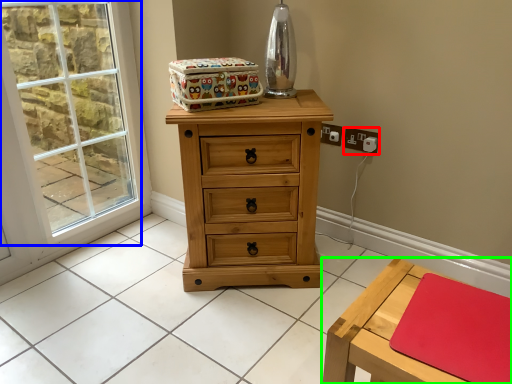
Question: Which object is the farthest from electric outlet (highlighted by a red box)? Choose among these: window (highlighted by a blue box) or table (highlighted by a green box).

Choices:
 (A) window
 (B) table

Answer: (A)